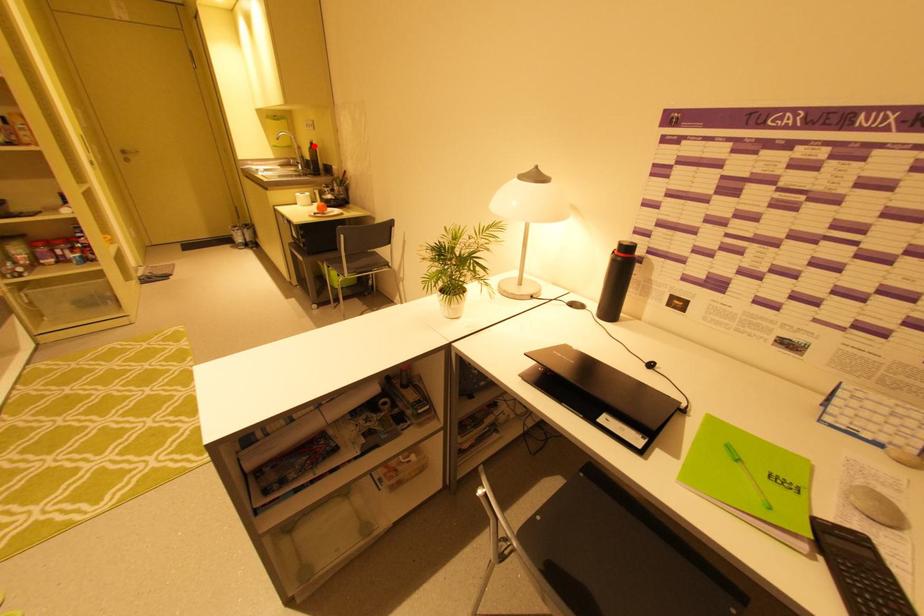
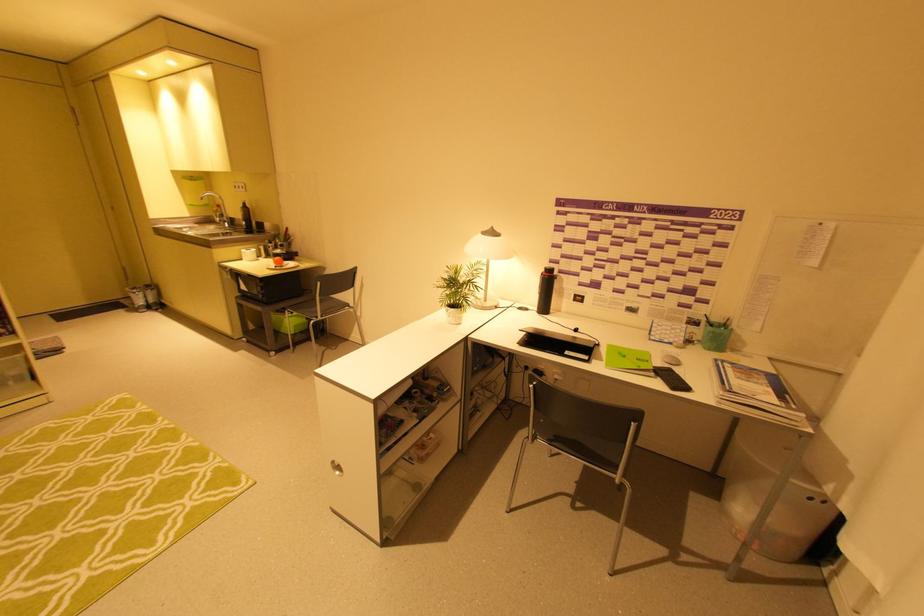
In the second image, find the point that corresponds to the highlighted location in the first image.

(246, 206)